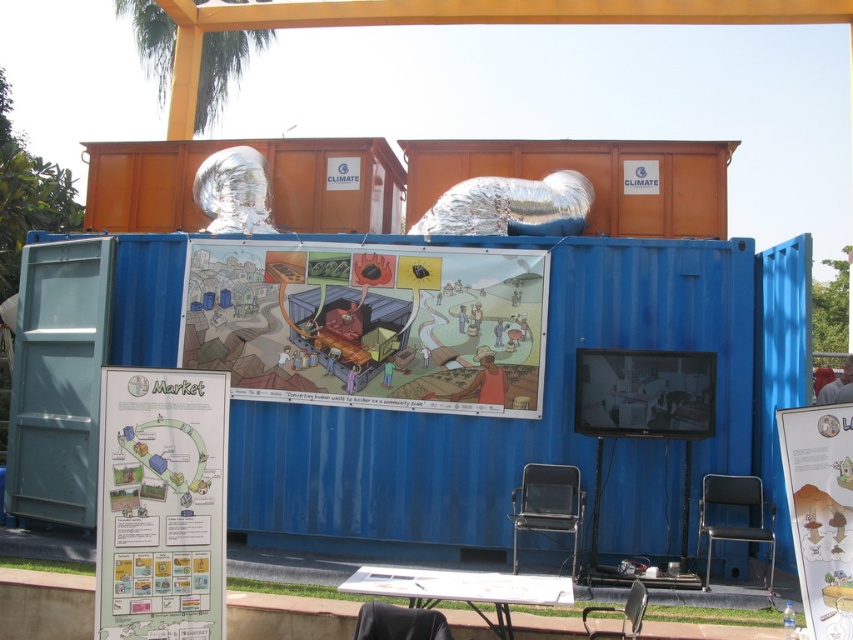
Which is more to the left, cartoon illustration at center or matte white poster at center?

cartoon illustration at center

The height and width of the screenshot is (640, 853). Find the location of `cartoon illustration at center`. cartoon illustration at center is located at coordinates (369, 324).

Who is more forward, (305, 392) or (786, 451)?

Point (786, 451) is in front.

You are a GUI agent. You are given a task and a screenshot of the screen. Output one action in this format:
    pyautogui.click(x=<x>, y=<y>)
    Task: Click on the cartoon illustration at center
    The height and width of the screenshot is (640, 853).
    Given the screenshot: What is the action you would take?
    pyautogui.click(x=369, y=324)

Does cartoon illustration at center come in front of white paper at center?

That is False.

Looking at this image, who is more forward, (460,298) or (215,515)?

Point (215,515) is more forward.

Find the location of a particular element. cartoon illustration at center is located at coordinates (369, 324).

The height and width of the screenshot is (640, 853). What do you see at coordinates (161, 504) in the screenshot?
I see `white paper at center` at bounding box center [161, 504].

Who is lower down, white paper at center or matte white poster at center?

matte white poster at center is below.

Locate an element on the screen. The width and height of the screenshot is (853, 640). white paper at center is located at coordinates (161, 504).